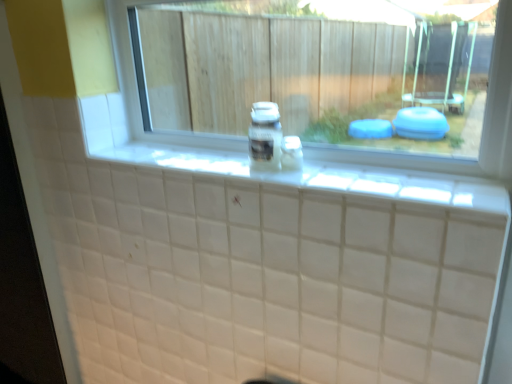
At what (x,y) coordinates should I click in order to perform the action: click on vacant point to the left of clear plastic bottle at center. Please return your answer as a coordinate pair (x, y). The image size is (512, 384). Looking at the image, I should click on (218, 163).